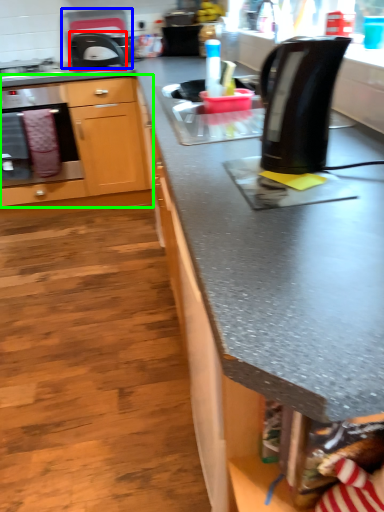
Question: Which is farther away from kitchen appliance (highlighted by a red box)? appliance (highlighted by a blue box) or cabinetry (highlighted by a green box)?

Choices:
 (A) appliance
 (B) cabinetry

Answer: (B)